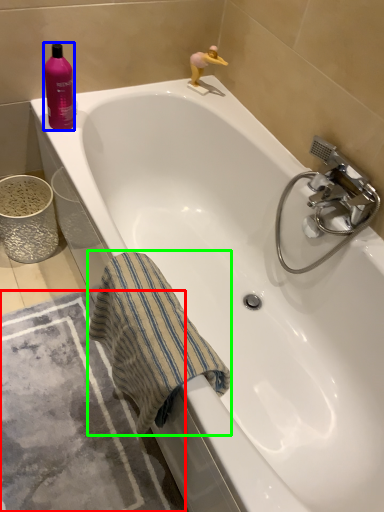
Question: Estimate the real-world distances between objects in this image. Which object is farther from bath mat (highlighted by a red box), cleaning product (highlighted by a blue box) or beach towel (highlighted by a green box)?

Choices:
 (A) cleaning product
 (B) beach towel

Answer: (A)